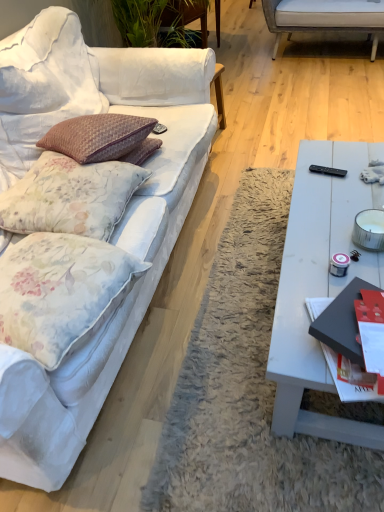
This screenshot has height=512, width=384. I want to click on vacant area on the back side of black plastic remote control at right, so 322,156.